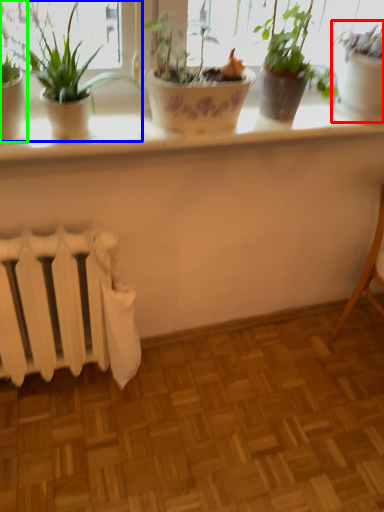
Question: Which object is the closest to the houseplant (highlighted by a red box)? Choose among these: houseplant (highlighted by a blue box) or houseplant (highlighted by a green box).

Choices:
 (A) houseplant
 (B) houseplant

Answer: (A)